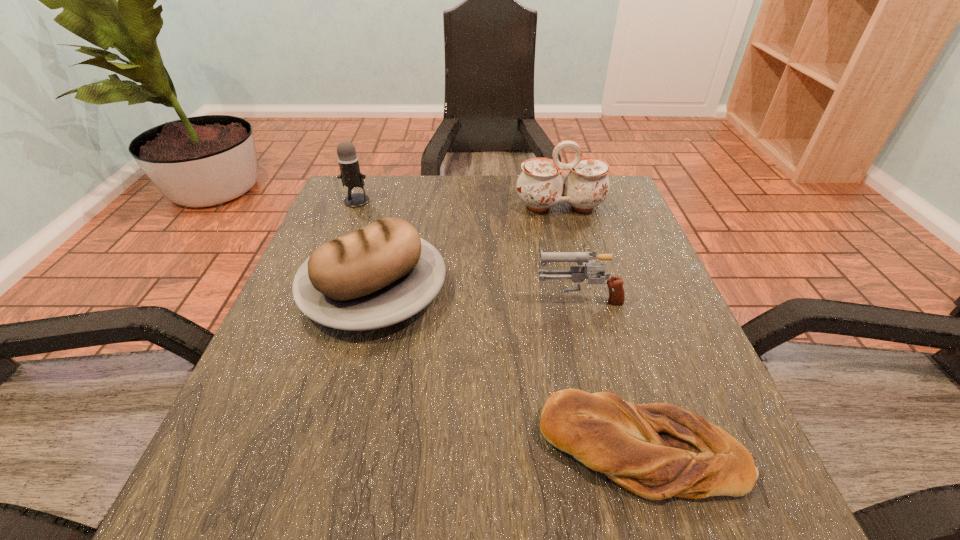
Identify the location of vacant area located at the barrel end of the gun. Image resolution: width=960 pixels, height=540 pixels. (390, 298).

Locate an element on the screen. vacant space located 0.270m at the barrel end of the gun is located at coordinates click(396, 298).

Locate an element on the screen. vacant space located 0.290m at the barrel end of the gun is located at coordinates (385, 298).

Image resolution: width=960 pixels, height=540 pixels. Find the location of `free space located 0.130m on the left of the shorter bread`. free space located 0.130m on the left of the shorter bread is located at coordinates (447, 448).

Identify the location of chinaware that is positioned at the far edge. This screenshot has height=540, width=960. (540, 186).

Where is `microphone located at the far edge`? microphone located at the far edge is located at coordinates point(350,175).

Where is `object present at the near edge`? object present at the near edge is located at coordinates (657, 450).

The height and width of the screenshot is (540, 960). Identify the location of microphone that is at the left edge. (350, 175).

The width and height of the screenshot is (960, 540). Find the location of `bread at the left edge`. bread at the left edge is located at coordinates (382, 274).

Find the location of a particular element. This screenshot has height=540, width=960. chinaware situated at the right edge is located at coordinates (540, 186).